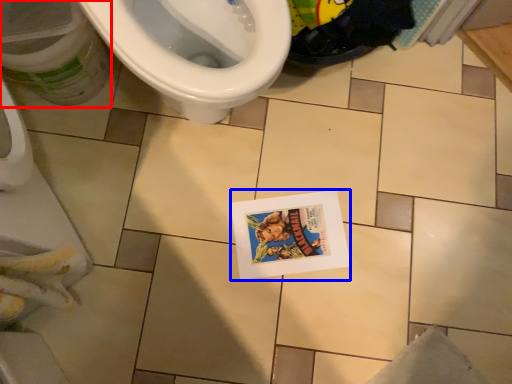
Question: Which of the following is the closest to the observer, potty (highlighted by a red box) or comic book (highlighted by a blue box)?

Choices:
 (A) potty
 (B) comic book

Answer: (A)